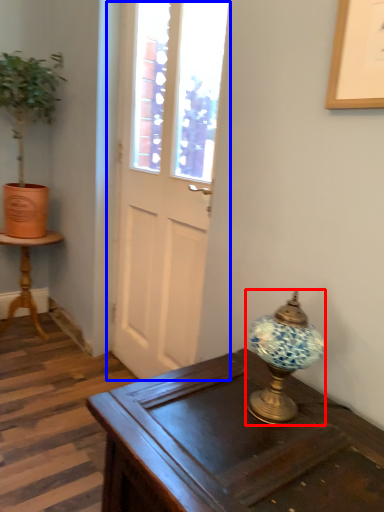
Question: Which of the following is the closest to the observer, lamp (highlighted by a red box) or door (highlighted by a blue box)?

Choices:
 (A) lamp
 (B) door

Answer: (A)